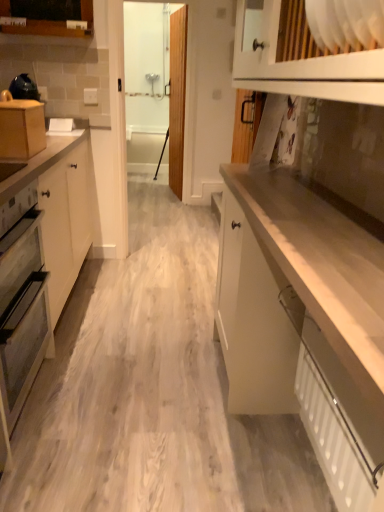
The width and height of the screenshot is (384, 512). Find the location of `vacant location below matte gray oven at left (from a real-world perspective)`. vacant location below matte gray oven at left (from a real-world perspective) is located at coordinates (36, 399).